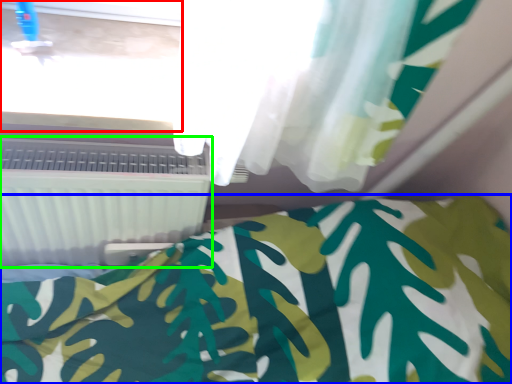
Question: Considering the real-world distances, which object is farthest from window frame (highlighted by a red box)? bed (highlighted by a blue box) or air conditioning (highlighted by a green box)?

Choices:
 (A) bed
 (B) air conditioning

Answer: (A)